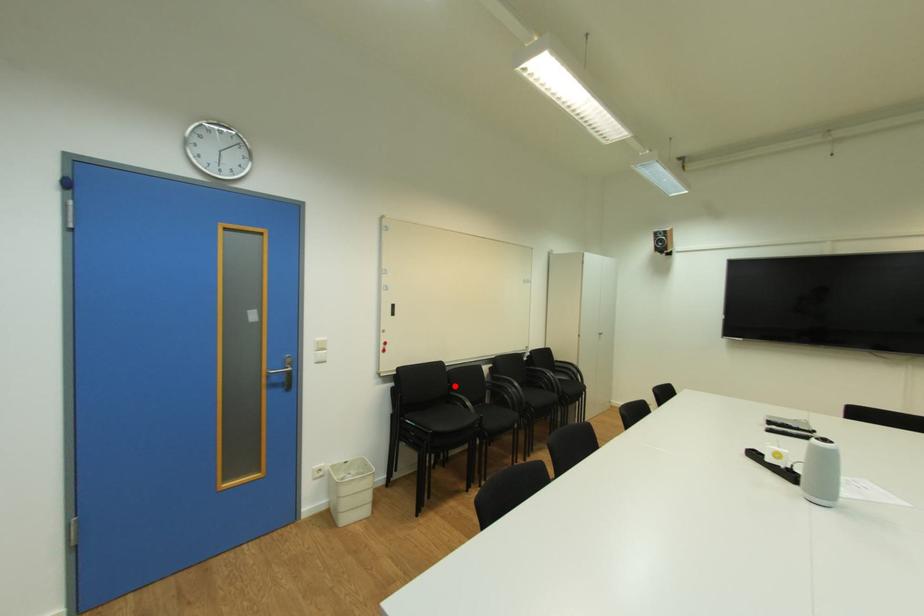
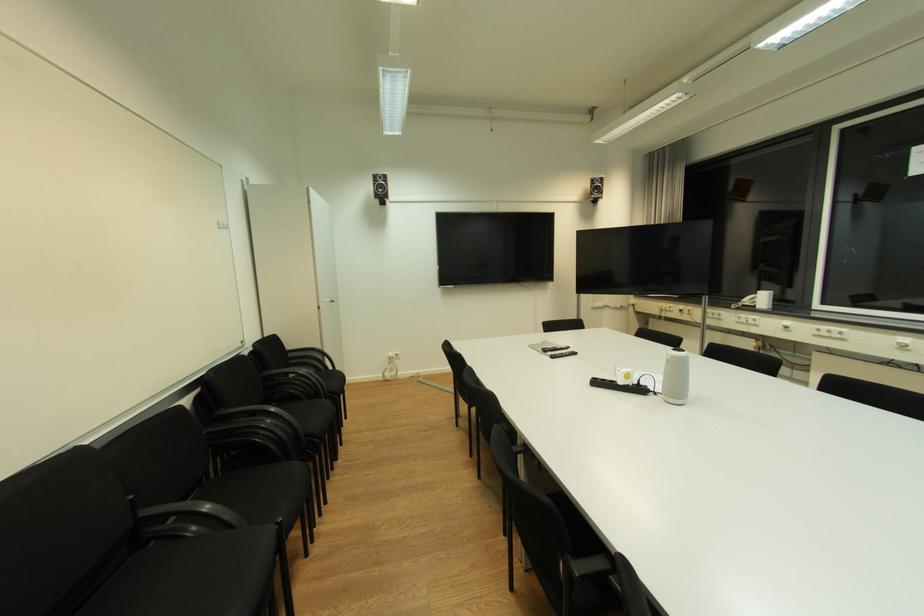
Locate, in the second image, the point that corresponds to the highlighted location in the first image.

(137, 498)